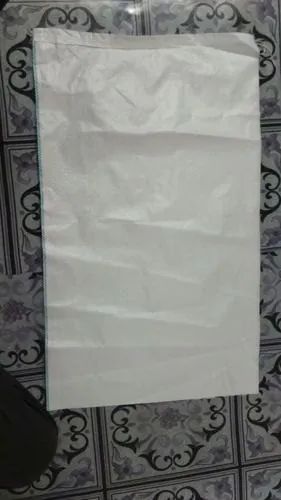
Identify the location of trash bag. (120, 363).